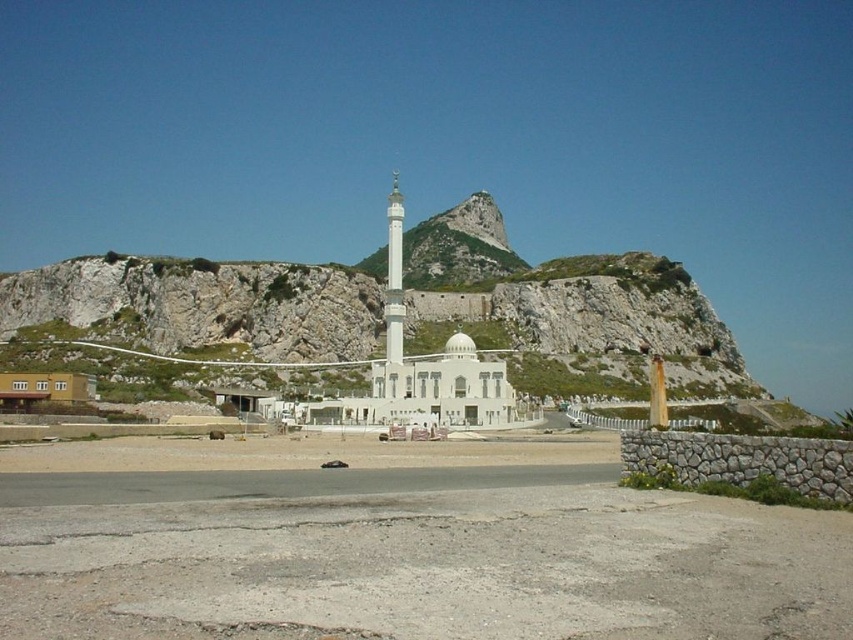
Can you confirm if gray stone wall at lower right is thinner than white marble minaret at center?

Correct, gray stone wall at lower right's width is less than white marble minaret at center's.

Which is in front, point (676, 465) or point (402, 321)?

Point (676, 465) is in front.

Which is behind, point (695, 449) or point (393, 196)?

The point (393, 196) is more distant.

This screenshot has height=640, width=853. In order to click on gray stone wall at lower right in this screenshot , I will do `click(743, 460)`.